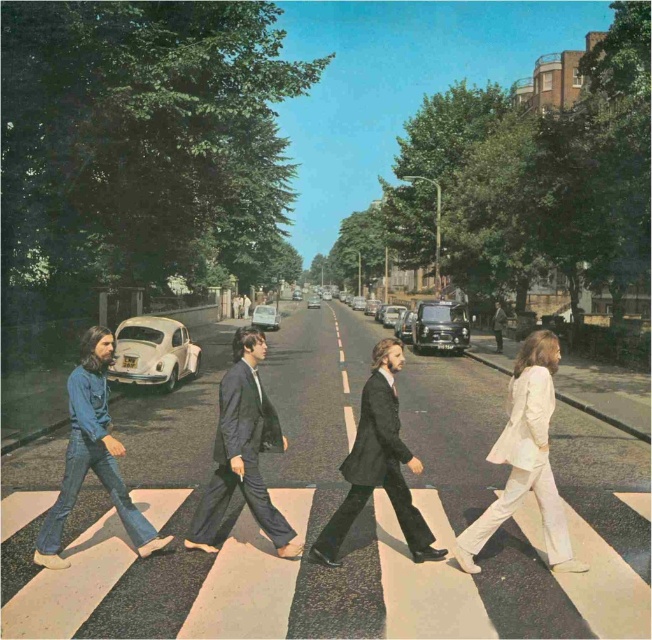
Question: Which point is farther to the camera?

Choices:
 (A) dark blue suit at center
 (B) dark gray suit at center
 (C) light brown leather jacket at center

Answer: (C)

Question: Is dark gray suit at center positioned before denim jeans at center?

Choices:
 (A) no
 (B) yes

Answer: (B)

Question: Estimate the real-world distances between objects in this image. Which object is closer to the light brown leather jacket at center?

Choices:
 (A) denim jeans at center
 (B) dark blue suit at center
 (C) dark gray suit at center

Answer: (C)

Question: Is dark gray suit at center closer to the viewer compared to light brown leather jacket at center?

Choices:
 (A) yes
 (B) no

Answer: (A)

Question: Does dark gray suit at center appear over denim jeans at center?

Choices:
 (A) yes
 (B) no

Answer: (B)

Question: Which of the following is the closest to the observer?

Choices:
 (A) light brown leather jacket at center
 (B) dark gray suit at center
 (C) dark blue suit at center
 (D) denim jeans at center

Answer: (B)